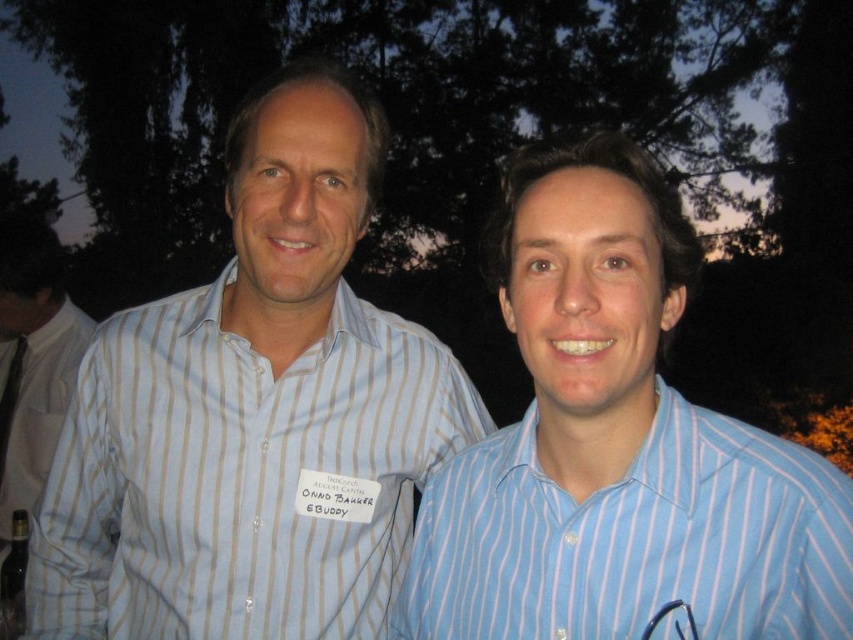
Question: Among these points, which one is nearest to the camera?

Choices:
 (A) (321, 435)
 (B) (605, 484)
 (C) (20, 401)

Answer: (B)

Question: Which of the following is the closest to the observer?

Choices:
 (A) light blue striped shirt at center
 (B) white striped shirt at left

Answer: (A)

Question: Does blue striped shirt at center have a greater width compared to white striped shirt at left?

Choices:
 (A) yes
 (B) no

Answer: (B)

Question: In this image, where is blue striped shirt at center located relative to white striped shirt at left?

Choices:
 (A) below
 (B) above

Answer: (B)

Question: Estimate the real-world distances between objects in this image. Which object is closer to the light blue striped shirt at center?

Choices:
 (A) blue striped shirt at center
 (B) white striped shirt at left

Answer: (A)

Question: Does blue striped shirt at center have a greater width compared to white striped shirt at left?

Choices:
 (A) no
 (B) yes

Answer: (A)